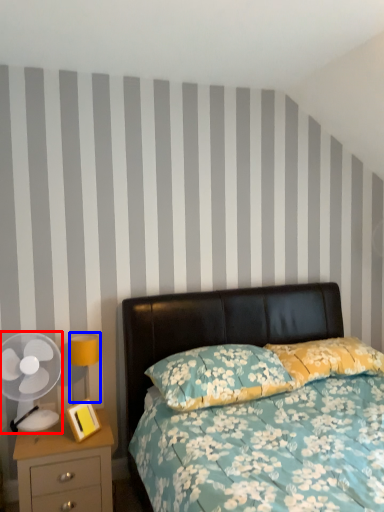
Question: Among these objects, which one is nearest to the camera, mechanical fan (highlighted by a red box) or bedside lamp (highlighted by a blue box)?

Choices:
 (A) mechanical fan
 (B) bedside lamp

Answer: (A)